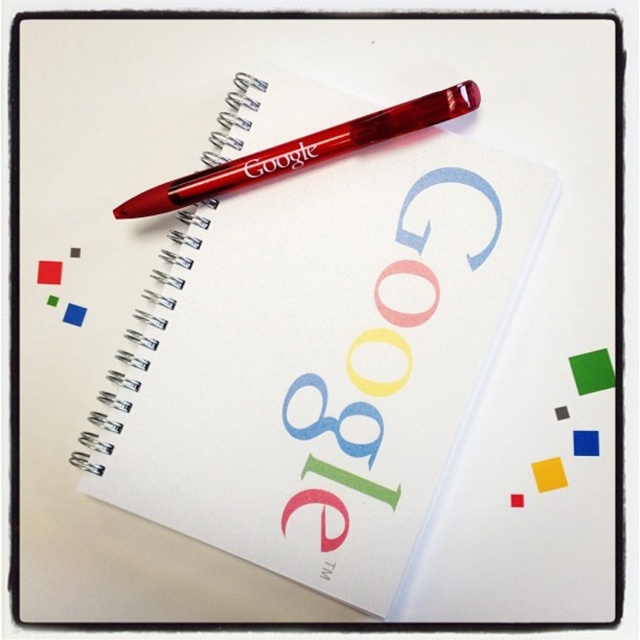
Is matte blue letter at center positioned at the back of smooth plastic g at center?

Yes.

Who is shorter, matte blue letter at center or smooth plastic g at center?

With less height is matte blue letter at center.

Identify the location of matte blue letter at center. (332, 419).

Find the location of a particular element. The height and width of the screenshot is (640, 640). matte blue letter at center is located at coordinates (332, 419).

Is point (266, 298) farther from camera compared to point (413, 189)?

Yes, it is behind point (413, 189).

Between transparent plastic notebook at center and smooth plastic g at center, which one is positioned lower?

transparent plastic notebook at center is below.

The width and height of the screenshot is (640, 640). Find the location of `transparent plastic notebook at center`. transparent plastic notebook at center is located at coordinates point(321,360).

Consider the image. Does transparent plastic notebook at center appear over transparent red pen at upper center?

No, transparent plastic notebook at center is not above transparent red pen at upper center.

Does transparent plastic notebook at center appear on the left side of transparent red pen at upper center?

Incorrect, transparent plastic notebook at center is not on the left side of transparent red pen at upper center.

Is point (211, 490) positioned after point (404, 120)?

Yes, it is behind point (404, 120).

Locate an element on the screen. This screenshot has height=640, width=640. transparent plastic notebook at center is located at coordinates (321, 360).